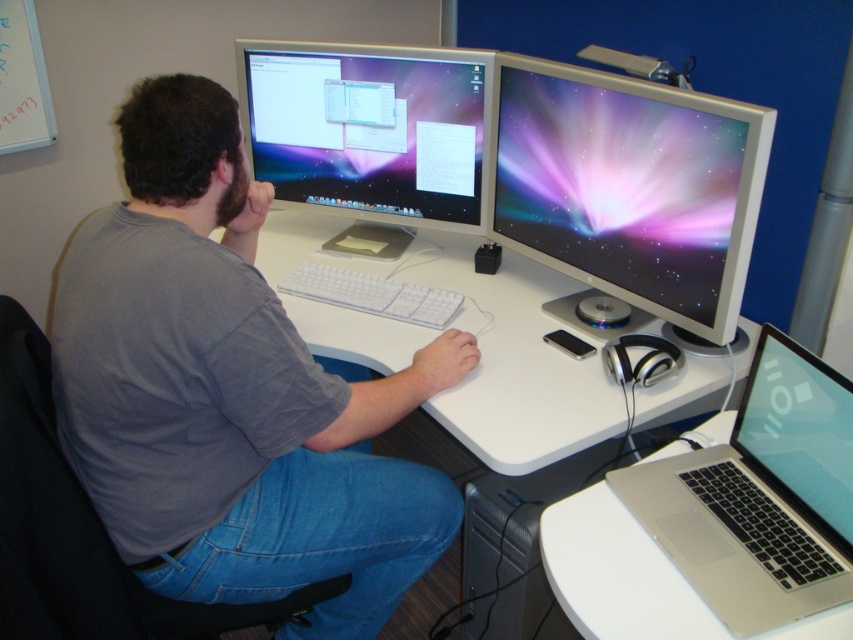
Question: Which object is positioned closest to the white plastic keyboard at center?

Choices:
 (A) silver metallic laptop at lower right
 (B) satin black monitor at center

Answer: (B)

Question: Can you confirm if white glossy monitor at right is positioned above silver metallic laptop at lower right?

Choices:
 (A) yes
 (B) no

Answer: (A)

Question: Which point is farther from the camera taking this photo?

Choices:
 (A) (403, 305)
 (B) (566, 230)
 (C) (392, 93)

Answer: (C)

Question: Is gray cotton shirt at center positioned at the back of white plastic computer desk at center?

Choices:
 (A) no
 (B) yes

Answer: (A)

Question: Which object is the farthest from the satin black laptop at lower right?

Choices:
 (A) white glossy monitor at right
 (B) white plastic computer desk at center
 (C) white plastic keyboard at center
 (D) satin black monitor at center

Answer: (D)

Question: Can you confirm if white plastic computer desk at center is bigger than silver metallic laptop at lower right?

Choices:
 (A) no
 (B) yes

Answer: (B)